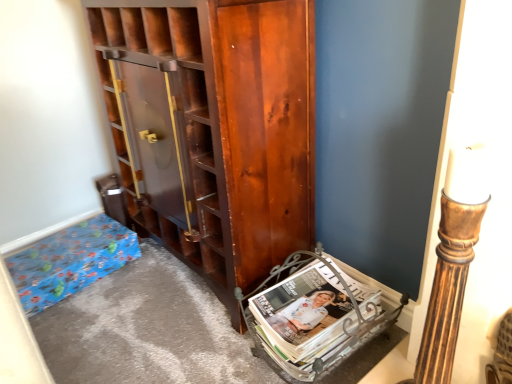
Question: Are shiny brown cabinet at center and matte metallic magazine rack at lower right far apart?

Choices:
 (A) no
 (B) yes

Answer: (A)

Question: From a real-world perspective, is shiny brown cabinet at center located higher than matte metallic magazine rack at lower right?

Choices:
 (A) no
 (B) yes

Answer: (B)

Question: Considering the relative sizes of shiny brown cabinet at center and matte metallic magazine rack at lower right in the image provided, is shiny brown cabinet at center wider than matte metallic magazine rack at lower right?

Choices:
 (A) yes
 (B) no

Answer: (A)

Question: Considering the relative positions of shiny brown cabinet at center and matte metallic magazine rack at lower right in the image provided, is shiny brown cabinet at center to the right of matte metallic magazine rack at lower right from the viewer's perspective?

Choices:
 (A) no
 (B) yes

Answer: (A)

Question: Does shiny brown cabinet at center come behind matte metallic magazine rack at lower right?

Choices:
 (A) yes
 (B) no

Answer: (B)

Question: From a real-world perspective, is blue paper bag at lower left positioned above or below shiny brown cabinet at center?

Choices:
 (A) below
 (B) above

Answer: (A)

Question: Does point (33, 304) appear closer or farther from the camera than point (146, 168)?

Choices:
 (A) farther
 (B) closer

Answer: (B)

Question: Would you say blue paper bag at lower left is inside or outside shiny brown cabinet at center?

Choices:
 (A) inside
 (B) outside

Answer: (B)

Question: In terms of height, does blue paper bag at lower left look taller or shorter compared to shiny brown cabinet at center?

Choices:
 (A) tall
 (B) short

Answer: (B)

Question: Is shiny brown cabinet at center bigger or smaller than matte metallic magazine rack at lower right?

Choices:
 (A) small
 (B) big

Answer: (B)

Question: In the image, is shiny brown cabinet at center positioned in front of or behind matte metallic magazine rack at lower right?

Choices:
 (A) behind
 (B) front

Answer: (B)

Question: In terms of height, does shiny brown cabinet at center look taller or shorter compared to matte metallic magazine rack at lower right?

Choices:
 (A) short
 (B) tall

Answer: (B)

Question: Looking at their shapes, would you say shiny brown cabinet at center is wider or thinner than matte metallic magazine rack at lower right?

Choices:
 (A) wide
 (B) thin

Answer: (A)

Question: From a real-world perspective, is blue paper bag at lower left physically located above or below matte metallic magazine rack at lower right?

Choices:
 (A) above
 (B) below

Answer: (B)

Question: Would you say blue paper bag at lower left is to the left or to the right of matte metallic magazine rack at lower right in the picture?

Choices:
 (A) right
 (B) left

Answer: (B)